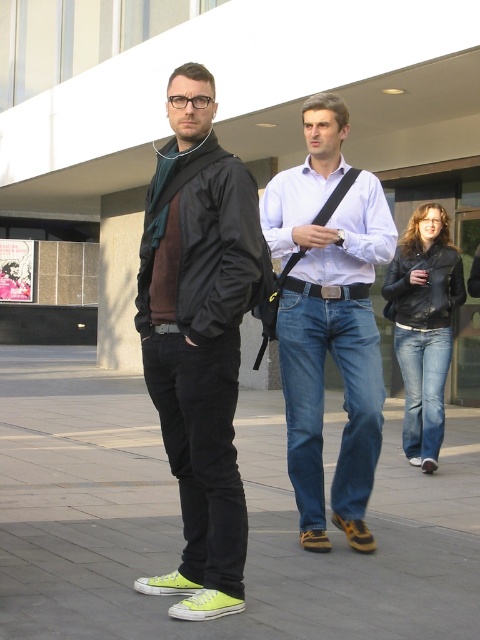
You are standing at the origin point in the image. The green canvas shoes at lower center are at coordinates point0.811, 0.519. Which direction should you move to reach them?

The green canvas shoes at lower center are located at point0.(249, 639), so you should move towards the lower center direction to reach them.